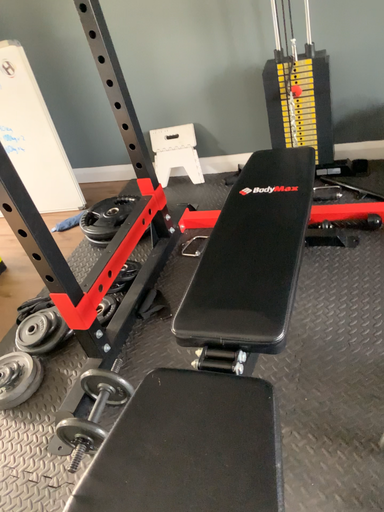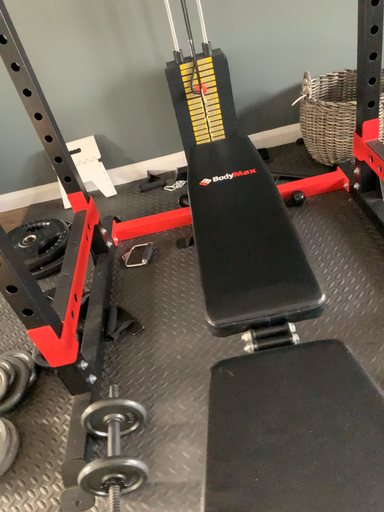
Question: Which way did the camera rotate in the video?

Choices:
 (A) rotated right
 (B) rotated left

Answer: (A)